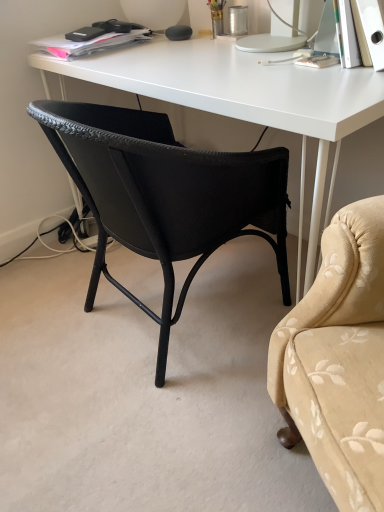
Where is `vacant space in front of black woven chair at center`? This screenshot has height=512, width=384. vacant space in front of black woven chair at center is located at coordinates (154, 436).